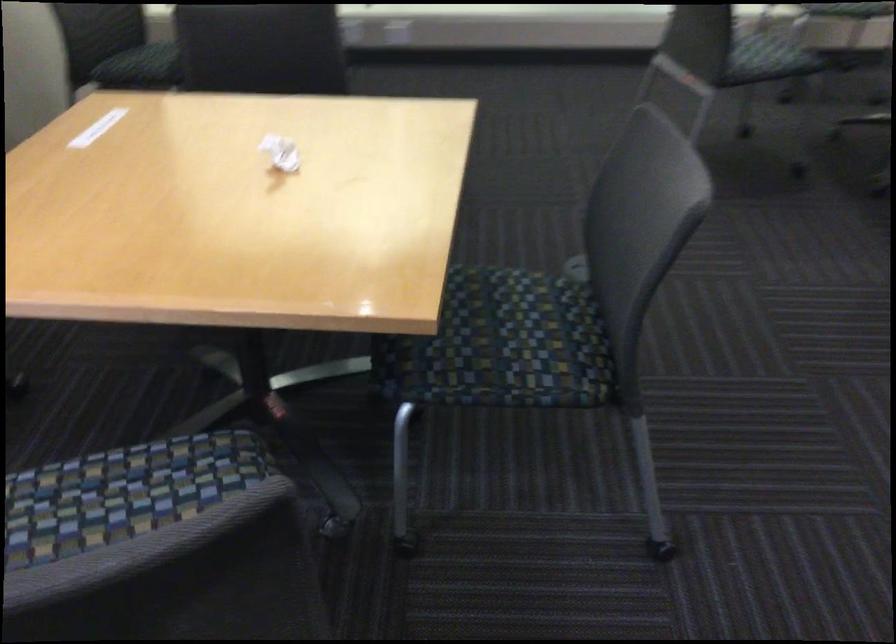
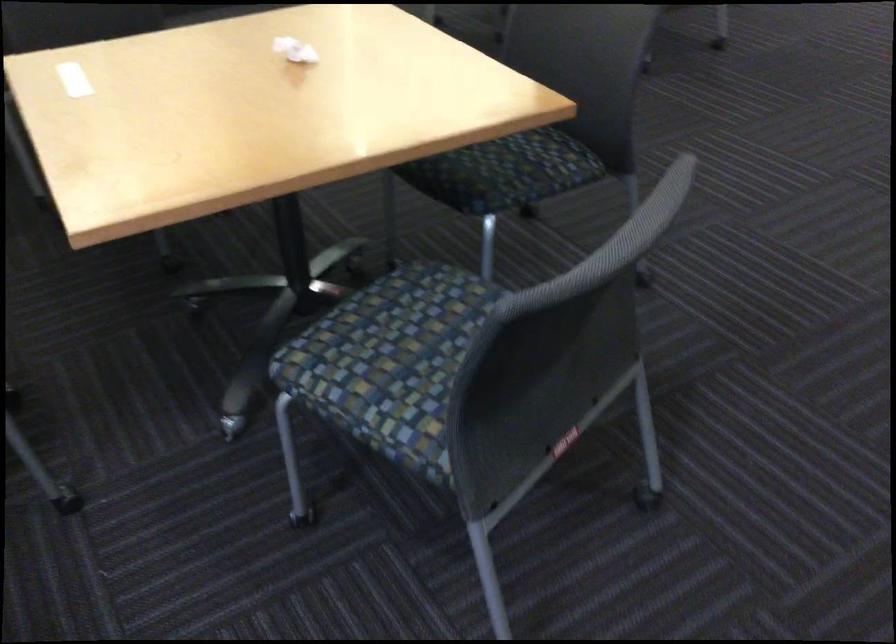
In the second image, find the point that corresponds to the point at 73,542 in the first image.

(391, 361)